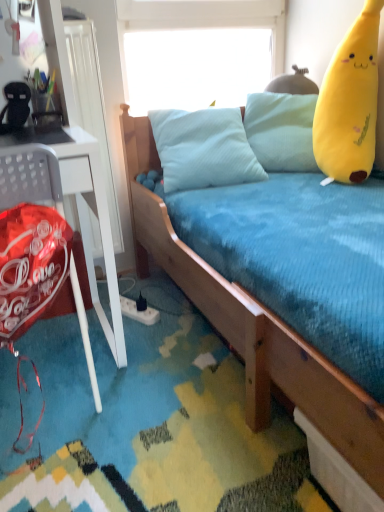
Locate an element on the screen. The image size is (384, 512). wooden bed at center is located at coordinates (264, 347).

Identify the location of wooden bed at center. (264, 347).

Between point (165, 53) and point (347, 470), which one is positioned behind?

The point (165, 53) is farther from the camera.

Could you tell me if transparent plastic window screen at upper center is facing wooden bed at center?

No, transparent plastic window screen at upper center is not oriented towards wooden bed at center.

Are transparent plastic window screen at upper center and wooden bed at center located far from each other?

That's not correct — transparent plastic window screen at upper center is a little close to wooden bed at center.

How much distance is there between transparent plastic window screen at upper center and wooden bed at center?

A distance of 27.63 inches exists between transparent plastic window screen at upper center and wooden bed at center.

Looking at the image, does transparent plastic window screen at upper center seem bigger or smaller compared to yellow plush toy at right?

In the image, transparent plastic window screen at upper center appears to be smaller than yellow plush toy at right.

From the image's perspective, who appears lower, transparent plastic window screen at upper center or yellow plush toy at right?

yellow plush toy at right.

Are transparent plastic window screen at upper center and yellow plush toy at right located far from each other?

No, transparent plastic window screen at upper center is not far from yellow plush toy at right.

From a real-world perspective, which is physically below, transparent plastic window screen at upper center or yellow plush toy at right?

yellow plush toy at right is physically lower.

From a real-world perspective, is shiny red balloon at left physically located above or below wooden bed at center?

Clearly, from a real-world perspective, shiny red balloon at left is below wooden bed at center.

From the image's perspective, is shiny red balloon at left located beneath wooden bed at center?

Yes, from the image's perspective, shiny red balloon at left is beneath wooden bed at center.

Can wooden bed at center be found inside shiny red balloon at left?

That's incorrect, wooden bed at center is not inside shiny red balloon at left.

Where is `bed on the right side of shiny red balloon at left`? This screenshot has width=384, height=512. bed on the right side of shiny red balloon at left is located at coordinates (264, 347).

In terms of width, does shiny red balloon at left look wider or thinner when compared to transparent plastic window screen at upper center?

In the image, shiny red balloon at left appears to be wider than transparent plastic window screen at upper center.

Is shiny red balloon at left located outside transparent plastic window screen at upper center?

shiny red balloon at left lies outside transparent plastic window screen at upper center's area.

Is point (23, 165) positioned behind point (197, 30)?

No, it is not.

From a real-world perspective, is shiny red balloon at left positioned under transparent plastic window screen at upper center based on gravity?

Yes.

Which is behind, point (22, 191) or point (360, 153)?

The point (360, 153) is more distant.

Is shiny red balloon at left thinner than yellow plush toy at right?

In fact, shiny red balloon at left might be wider than yellow plush toy at right.

Is shiny red balloon at left oriented towards yellow plush toy at right?

No.

Where is `chair lying on the left of yellow plush toy at right`? This screenshot has width=384, height=512. chair lying on the left of yellow plush toy at right is located at coordinates tap(30, 176).

What's the angular difference between yellow plush toy at right and shiny red balloon at left's facing directions?

There is a 140-degree angle between the facing directions of yellow plush toy at right and shiny red balloon at left.

Is yellow plush toy at right oriented towards shiny red balloon at left?

No, yellow plush toy at right is not facing towards shiny red balloon at left.

From a real-world perspective, is yellow plush toy at right positioned above or below shiny red balloon at left?

yellow plush toy at right is above shiny red balloon at left.

Where is `chair below the yellow plush toy at right (from the image's perspective)`? This screenshot has height=512, width=384. chair below the yellow plush toy at right (from the image's perspective) is located at coordinates (30, 176).

Between wooden bed at center and shiny red balloon at left, which one appears on the left side from the viewer's perspective?

Positioned to the left is shiny red balloon at left.

In the scene shown: Is wooden bed at center looking in the opposite direction of shiny red balloon at left?

No, wooden bed at center's orientation is not away from shiny red balloon at left.

Is wooden bed at center bigger than shiny red balloon at left?

Indeed, wooden bed at center has a larger size compared to shiny red balloon at left.

Consider the image. Is wooden bed at center in front of or behind shiny red balloon at left in the image?

wooden bed at center is in front of shiny red balloon at left.

Locate an element on the screen. This screenshot has height=512, width=384. bed in front of the transparent plastic window screen at upper center is located at coordinates (264, 347).

In the image, there is a yellow plush toy at right. Where is `window screen above it (from the image's perspective)`? This screenshot has height=512, width=384. window screen above it (from the image's perspective) is located at coordinates (198, 51).

Looking at this image, estimate the real-world distances between objects in this image. Which object is closer to yellow plush toy at right, wooden bed at center or shiny red balloon at left?

Among the two, wooden bed at center is located nearer to yellow plush toy at right.

When comparing their distances from wooden bed at center, does yellow plush toy at right or shiny red balloon at left seem further?

The object further to wooden bed at center is yellow plush toy at right.

Which object lies nearer to the anchor point transparent plastic window screen at upper center, shiny red balloon at left or wooden bed at center?

wooden bed at center is closer to transparent plastic window screen at upper center.

From the image, which object appears to be nearer to yellow plush toy at right, transparent plastic window screen at upper center or wooden bed at center?

transparent plastic window screen at upper center.

Considering their positions, is shiny red balloon at left positioned closer to transparent plastic window screen at upper center than yellow plush toy at right?

yellow plush toy at right is closer to transparent plastic window screen at upper center.

Consider the image. Considering their positions, is transparent plastic window screen at upper center positioned further to wooden bed at center than shiny red balloon at left?

The object further to wooden bed at center is transparent plastic window screen at upper center.

Considering their positions, is shiny red balloon at left positioned closer to yellow plush toy at right than transparent plastic window screen at upper center?

The object closer to yellow plush toy at right is transparent plastic window screen at upper center.

Which object lies further to the anchor point shiny red balloon at left, yellow plush toy at right or transparent plastic window screen at upper center?

transparent plastic window screen at upper center lies further to shiny red balloon at left than the other object.

This screenshot has width=384, height=512. I want to click on bed between shiny red balloon at left and yellow plush toy at right, so click(x=264, y=347).

Locate an element on the screen. This screenshot has width=384, height=512. window screen between shiny red balloon at left and yellow plush toy at right from left to right is located at coordinates (198, 51).

Where is `toy between wooden bed at center and transparent plastic window screen at upper center from front to back`? toy between wooden bed at center and transparent plastic window screen at upper center from front to back is located at coordinates (349, 103).

Find the location of a particular element. Image resolution: width=384 pixels, height=512 pixels. chair located between wooden bed at center and transparent plastic window screen at upper center in the depth direction is located at coordinates (30, 176).